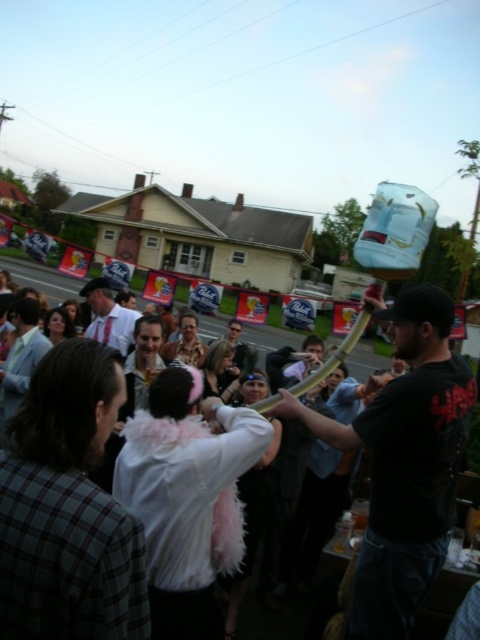
You are at a party and want to know which object is smaller between the black matte pipe at center and the matte white shirt at center. Can you tell me?

The black matte pipe at center has a smaller size compared to the matte white shirt at center, so the black matte pipe at center is smaller.

Based on the photo, you are standing at the edge of the gathering and want to take a photo of the white shirt at center and the black matte pipe at center. Which object will appear larger in your photo?

The black matte pipe at center will appear larger in the photo because it is closer to the viewer than the white shirt at center.